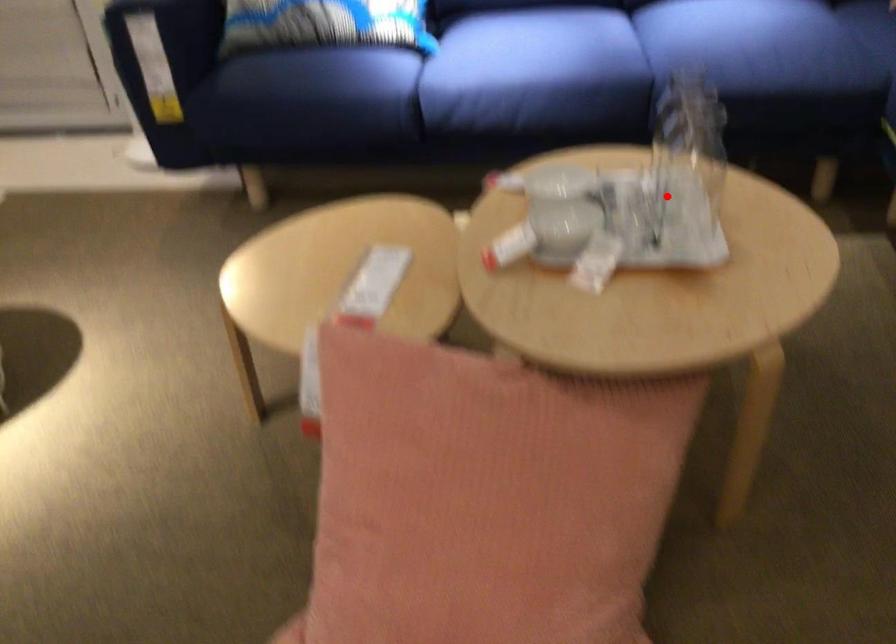
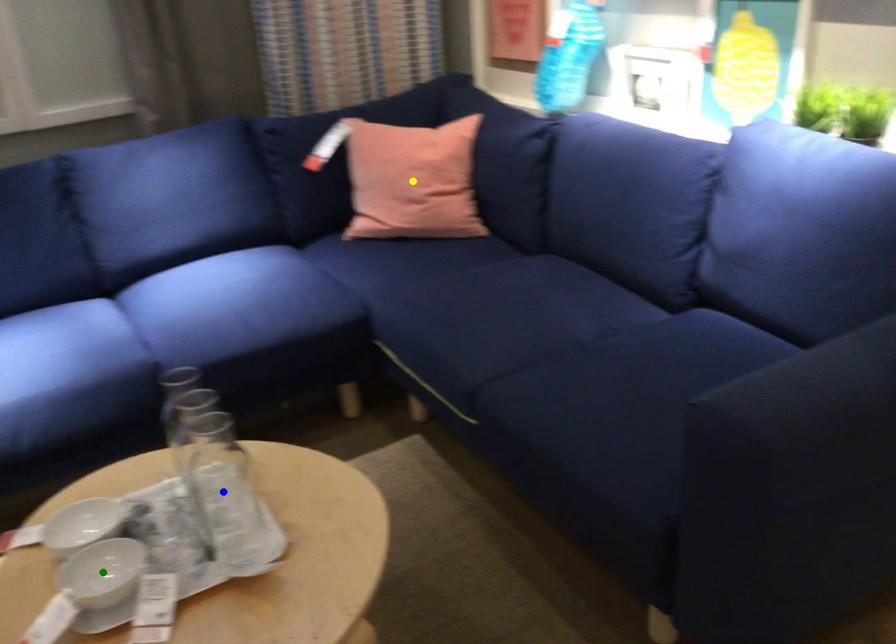
Question: I am providing you with two images of the same scene from different viewpoints. A red point is marked on the first image. You are given multiple points on the second image. Which point in image 2 represents the same 3d spot as the red point in image 1?

Choices:
 (A) yellow point
 (B) blue point
 (C) green point

Answer: (B)